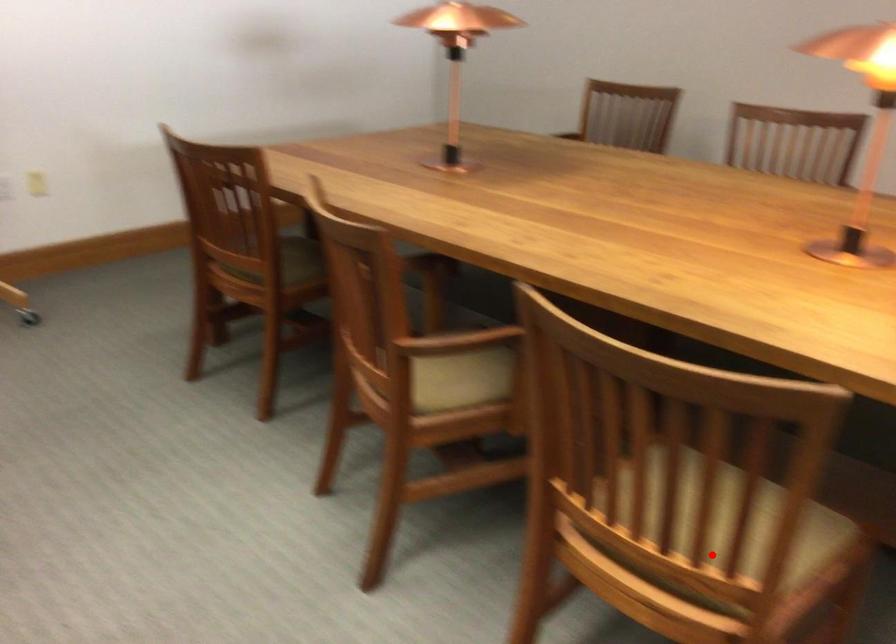
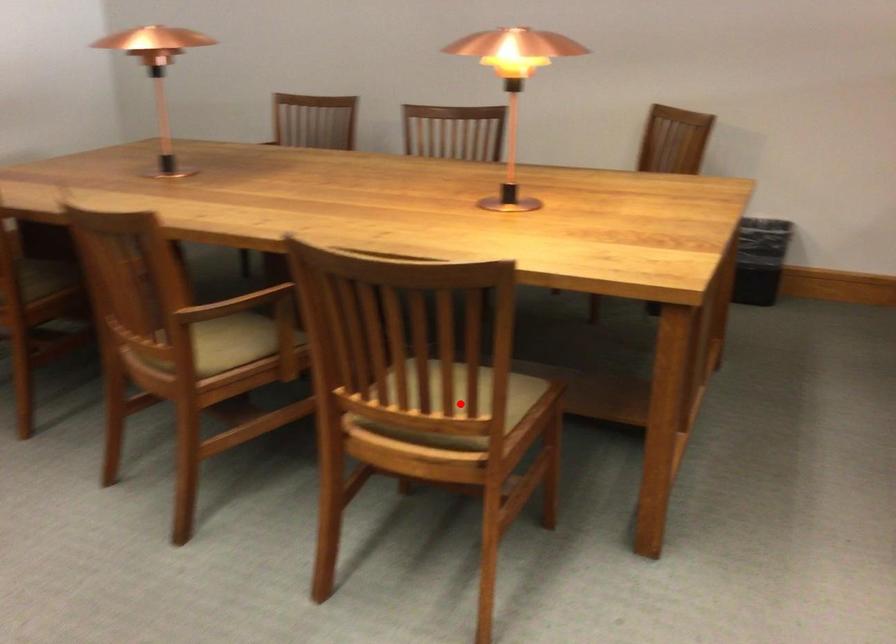
I am providing you with two images of the same scene from different viewpoints. A red point is marked on the first image and another point is marked on the second image. Are the points marked in image1 and image2 representing the same 3D position?

Yes